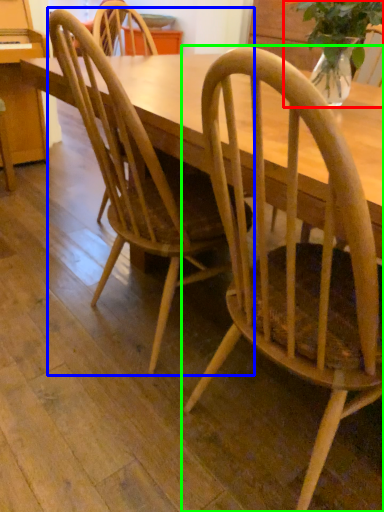
Question: Which object is the farthest from houseplant (highlighted by a red box)? Choose among these: chair (highlighted by a blue box) or chair (highlighted by a green box).

Choices:
 (A) chair
 (B) chair

Answer: (A)